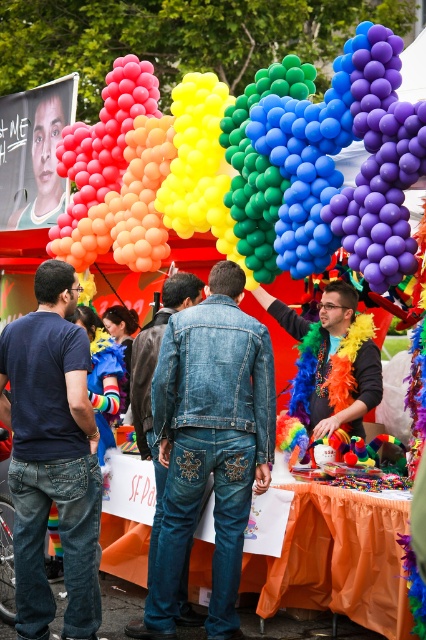
You are at a festival and see a denim jacket at center and a rainbow feather boa at center. Which item is taller?

The denim jacket at center is taller than the rainbow feather boa at center.

You are at the festival and want to find the rainbow balloons. According to the map, there is a point marked at coordinates (x=304, y=170). Where should you look for the rainbow balloons?

The point at (x=304, y=170) marks the rainbow balloons at upper center, so you should look at the upper center area to find them.